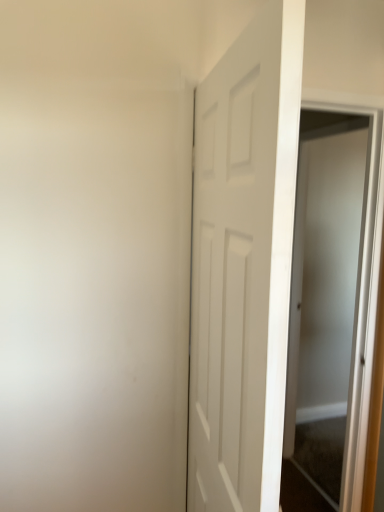
Identify the location of clear glass screen door at right. The image size is (384, 512). (334, 298).

This screenshot has width=384, height=512. Describe the element at coordinates (334, 298) in the screenshot. I see `clear glass screen door at right` at that location.

The width and height of the screenshot is (384, 512). What do you see at coordinates (235, 273) in the screenshot?
I see `white matte door at center` at bounding box center [235, 273].

The width and height of the screenshot is (384, 512). I want to click on white matte door at center, so click(x=235, y=273).

The height and width of the screenshot is (512, 384). Find the location of `clear glass screen door at right`. clear glass screen door at right is located at coordinates (334, 298).

Between clear glass screen door at right and white matte door at center, which one appears on the right side from the viewer's perspective?

From the viewer's perspective, clear glass screen door at right appears more on the right side.

Does clear glass screen door at right come in front of white matte door at center?

No, it is behind white matte door at center.

Is point (299, 465) behind point (222, 102)?

That is True.

From the image's perspective, is clear glass screen door at right on white matte door at center?

Actually, clear glass screen door at right appears below white matte door at center in the image.

From a real-world perspective, who is located lower, clear glass screen door at right or white matte door at center?

clear glass screen door at right is physically lower.

Is clear glass screen door at right wider than white matte door at center?

No, clear glass screen door at right is not wider than white matte door at center.

Between clear glass screen door at right and white matte door at center, which one has less height?

With less height is white matte door at center.

Based on their sizes in the image, would you say clear glass screen door at right is bigger or smaller than white matte door at center?

Considering their sizes, clear glass screen door at right takes up less space than white matte door at center.

Is white matte door at center completely or partially inside clear glass screen door at right?

Definitely not — white matte door at center is not inside clear glass screen door at right.

Is clear glass screen door at right next to white matte door at center?

No, clear glass screen door at right is not beside white matte door at center.

Is clear glass screen door at right oriented towards white matte door at center?

→ No, clear glass screen door at right is not oriented towards white matte door at center.

Identify the location of screen door located on the right of white matte door at center. The image size is (384, 512). (334, 298).

Based on the photo, is white matte door at center at the left side of clear glass screen door at right?

Yes.

Is white matte door at center in front of clear glass screen door at right?

Yes, it is in front of clear glass screen door at right.

Which point is more distant from viewer, (216, 440) or (369, 286)?

The point (369, 286) is farther.

From the image's perspective, relative to clear glass screen door at right, is white matte door at center above or below?

Clearly, from the image's perspective, white matte door at center is above clear glass screen door at right.

From a real-world perspective, is white matte door at center on clear glass screen door at right?

Correct, in the physical world, white matte door at center is higher than clear glass screen door at right.

Does white matte door at center have a lesser width compared to clear glass screen door at right?

Incorrect, the width of white matte door at center is not less than that of clear glass screen door at right.

Considering the relative sizes of white matte door at center and clear glass screen door at right in the image provided, is white matte door at center shorter than clear glass screen door at right?

Yes, white matte door at center is shorter than clear glass screen door at right.

Is white matte door at center bigger than clear glass screen door at right?

Correct, white matte door at center is larger in size than clear glass screen door at right.

Is white matte door at center located outside clear glass screen door at right?

Absolutely, white matte door at center is external to clear glass screen door at right.

Is white matte door at center positioned far away from clear glass screen door at right?

Yes, white matte door at center and clear glass screen door at right are quite far apart.

Is white matte door at center aimed at clear glass screen door at right?

No, white matte door at center is not facing towards clear glass screen door at right.

Can you tell me how much white matte door at center and clear glass screen door at right differ in facing direction?

The angular difference between white matte door at center and clear glass screen door at right is 171 degrees.

What are the coordinates of `door above the clear glass screen door at right (from the image's perspective)` in the screenshot? It's located at (235, 273).

Where is `door located on the left of clear glass screen door at right`? door located on the left of clear glass screen door at right is located at coordinates (235, 273).

Find the location of a particular element. screen door on the right of white matte door at center is located at coordinates (334, 298).